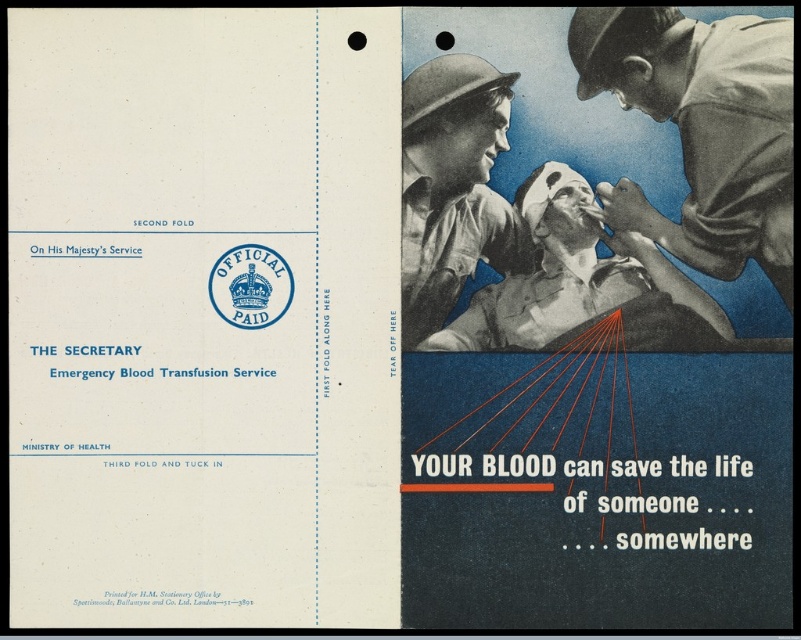
Is matte khaki uniform at center bigger than matte gray uniform at center?

No, matte khaki uniform at center is not bigger than matte gray uniform at center.

Can you confirm if matte khaki uniform at center is shorter than matte gray uniform at center?

In fact, matte khaki uniform at center may be taller than matte gray uniform at center.

What do you see at coordinates (453, 188) in the screenshot?
I see `matte khaki uniform at center` at bounding box center [453, 188].

Locate an element on the screen. The image size is (801, 640). matte khaki uniform at center is located at coordinates (453, 188).

Can you confirm if blue uniform shirt at upper right is positioned below matte gray uniform at center?

No, blue uniform shirt at upper right is not below matte gray uniform at center.

Is point (747, 236) positioned after point (469, 308)?

No, it is in front of (469, 308).

Locate an element on the screen. blue uniform shirt at upper right is located at coordinates (702, 129).

Between blue uniform shirt at upper right and matte khaki uniform at center, which one appears on the left side from the viewer's perspective?

Positioned to the left is matte khaki uniform at center.

Which is above, blue uniform shirt at upper right or matte khaki uniform at center?

blue uniform shirt at upper right is above.

Locate an element on the screen. The width and height of the screenshot is (801, 640). blue uniform shirt at upper right is located at coordinates (702, 129).

The height and width of the screenshot is (640, 801). I want to click on blue uniform shirt at upper right, so click(702, 129).